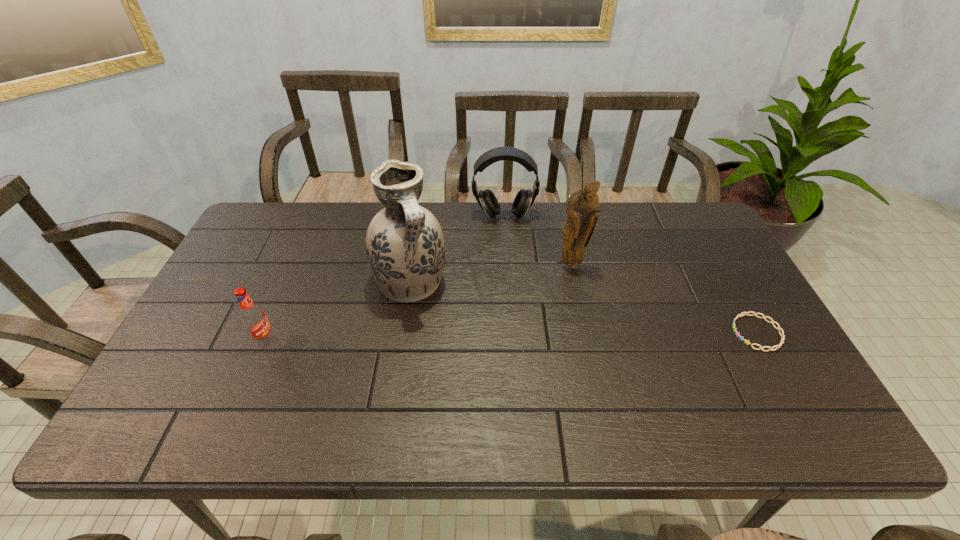
Where is `vacant region between the leftmost object and the second tallest object`? vacant region between the leftmost object and the second tallest object is located at coordinates (419, 303).

The image size is (960, 540). I want to click on vacant area between the farthest object and the second object from left to right, so click(458, 249).

This screenshot has height=540, width=960. I want to click on free space between the third tallest object and the figurine, so [x=538, y=241].

This screenshot has height=540, width=960. Identify the location of free space between the tallest object and the third shortest object. (458, 249).

Identify the location of free space that is in between the earphone and the fourth object from right to left. (458, 249).

You are a GUI agent. You are given a task and a screenshot of the screen. Output one action in this format:
    pyautogui.click(x=<x>, y=<y>)
    Task: Click on the vacant region between the fourth shortest object and the second object from left to right
    This screenshot has width=960, height=540.
    Given the screenshot: What is the action you would take?
    pyautogui.click(x=492, y=274)

Find the location of `empty location between the fourth object from right to left and the fourth object from left to right`. empty location between the fourth object from right to left and the fourth object from left to right is located at coordinates (492, 274).

Locate an element on the screen. This screenshot has height=540, width=960. the second closest object to the third tallest object is located at coordinates (582, 206).

Where is `object that ranks as the fourth closest to the figurine`? The image size is (960, 540). object that ranks as the fourth closest to the figurine is located at coordinates click(253, 317).

At what (x,y) coordinates should I click in order to perform the action: click on vacant position in the image that satisfies the following two spatial constraints: 1. on the front side of the bracelet; 2. on the surface of the fourth object from left to right showing star-shaped elements. Please return your answer as a coordinate pair (x, y). The height and width of the screenshot is (540, 960). Looking at the image, I should click on (586, 333).